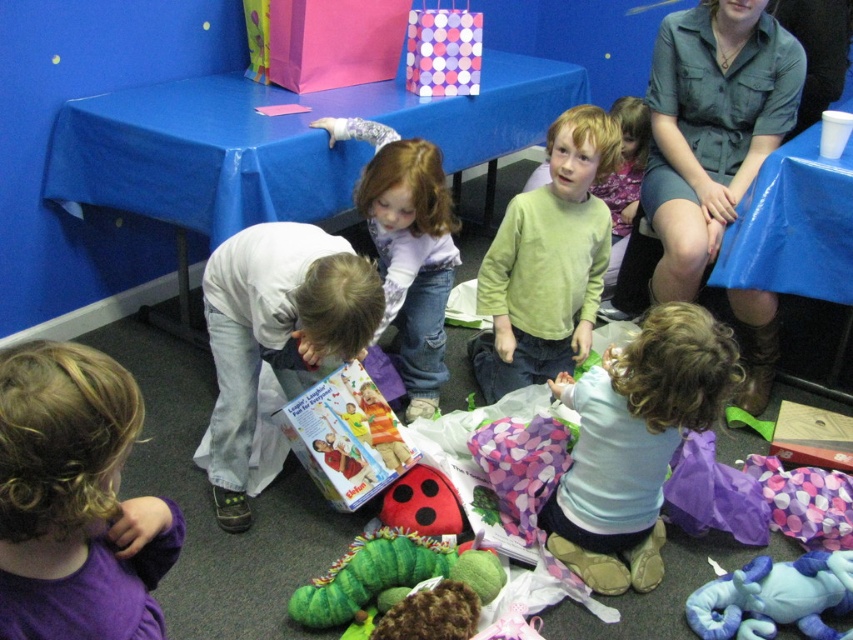
You are standing in the middle of the room and want to pick up an item from the floor. You notice two points marked in the scene. Which point, point 1 at coordinates (x=370, y=163) or point 2 at coordinates (x=741, y=600), is closer to you?

Point 1 at coordinates (x=370, y=163) is closer to you because it is further to the viewer than point 2 at coordinates (x=741, y=600).

You are a photographer trying to capture a candid shot of the light brown hair at center and the blue plush elephant at lower right. Since you want to ensure both subjects are in focus, you need to know which one is taller. Can you determine which object is taller?

The light brown hair at center has a greater height compared to the blue plush elephant at lower right, so the photographer should focus on the taller light brown hair at center to ensure both are in focus.

You are a parent trying to hand out gifts to your children. You are standing at point (x=103, y=472). The gifts are spread out on the floor in front of you. If you want to reach the closest gift, which direction should you move? Please answer with either left, right, forward, or backward.

The closest gift is located in the direction you need to move forward from point (x=103, y=472) because the gifts are spread out on the floor in front of you.